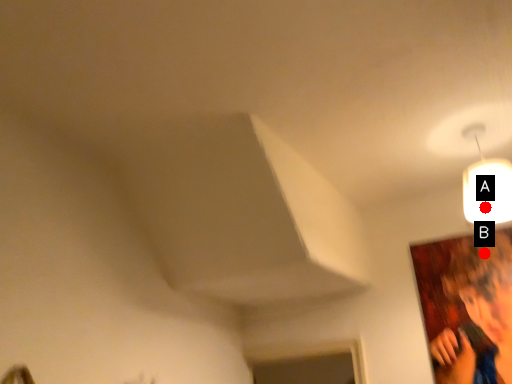
Question: Two points are circled on the image, labeled by A and B beside each circle. Which of the following is the closest to the observer?

Choices:
 (A) A is closer
 (B) B is closer

Answer: (A)